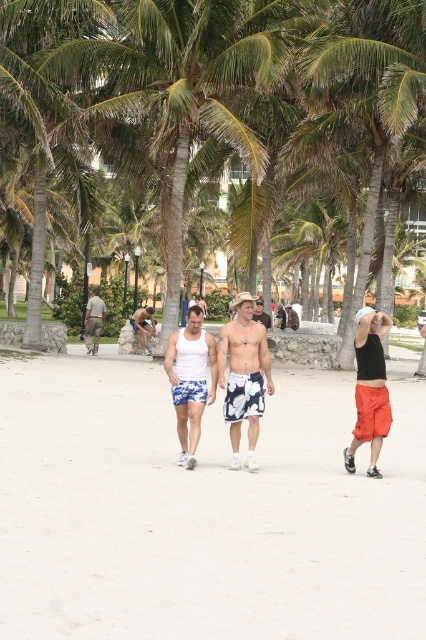
You are a photographer standing 2 meters away from the white cotton tank top at center. You want to take a photo of the white floral shorts at center without moving. Can you capture it in your current position?

The white floral shorts at center is 3.13 meters from the white cotton tank top at center. Since you are 2 meters away from the white cotton tank top at center, the distance between you and the white floral shorts at center would be 5.13 meters. However, without knowing the field of view of your camera, it is impossible to determine if the white floral shorts at center can be captured without moving.

From the picture: You are a tailor observing the beach scene. You need to determine which pair of shorts, the matte khaki shorts at left or the floral shorts at center, requires more fabric for a similar design. Based on the visual cues in the scene, which one would you estimate needs more material?

The matte khaki shorts at left might be wider than floral shorts at center, so they likely require more fabric.